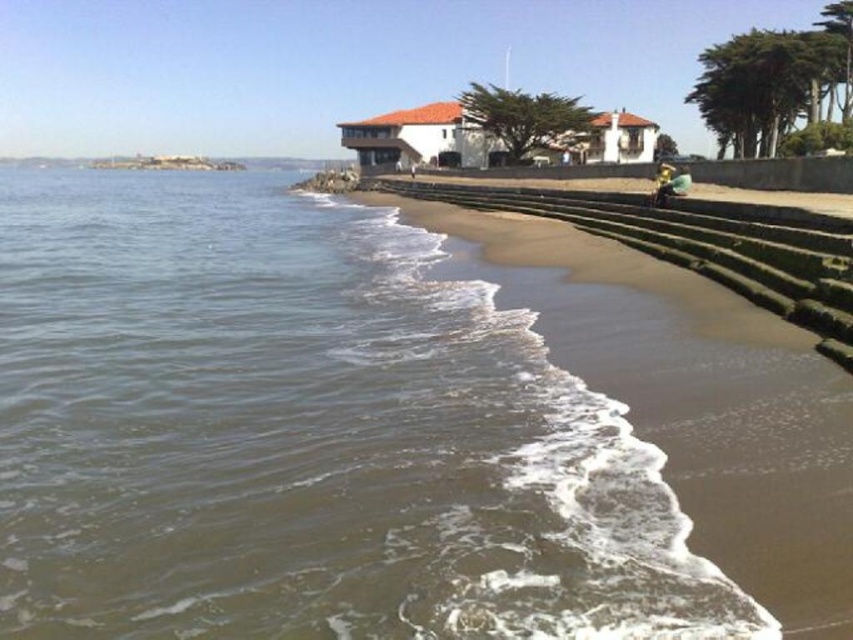
You are standing at the point with coordinates [306,435] in the coastal scene. What type of surface are you most likely standing on?

The point at [306,435] corresponds to the brown matte water at lower left, so you are standing on water.

You are standing on the beach and see the brown matte water at lower left and the golden metallic helmet at lower right. Which object is closer to your right side?

The golden metallic helmet at lower right is closer to your right side because it is positioned to the right of the brown matte water at lower left.